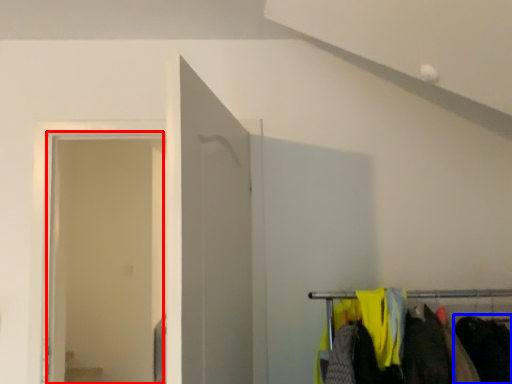
Question: Which point is closer to the camera, glass door (highlighted by a red box) or clothing (highlighted by a blue box)?

Choices:
 (A) glass door
 (B) clothing

Answer: (B)